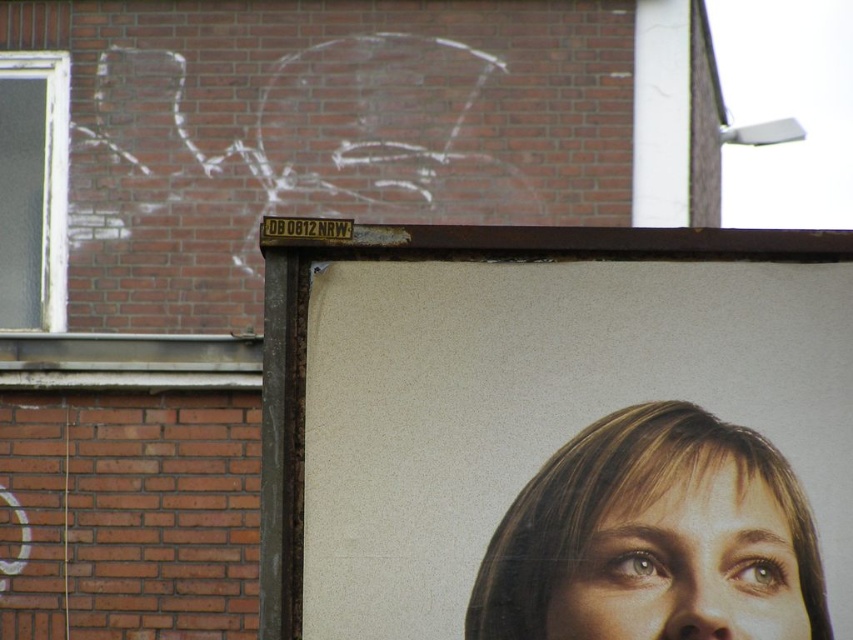
Is smooth skin face at center thinner than matte paper poster at center?

Yes, smooth skin face at center is thinner than matte paper poster at center.

The width and height of the screenshot is (853, 640). What are the coordinates of `smooth skin face at center` in the screenshot? It's located at 654,538.

Is point (544, 532) positioned after point (851, 552)?

Yes, it is behind point (851, 552).

You are a GUI agent. You are given a task and a screenshot of the screen. Output one action in this format:
    pyautogui.click(x=<x>, y=<y>)
    Task: Click on the smooth skin face at center
    The height and width of the screenshot is (640, 853).
    Given the screenshot: What is the action you would take?
    pyautogui.click(x=654, y=538)